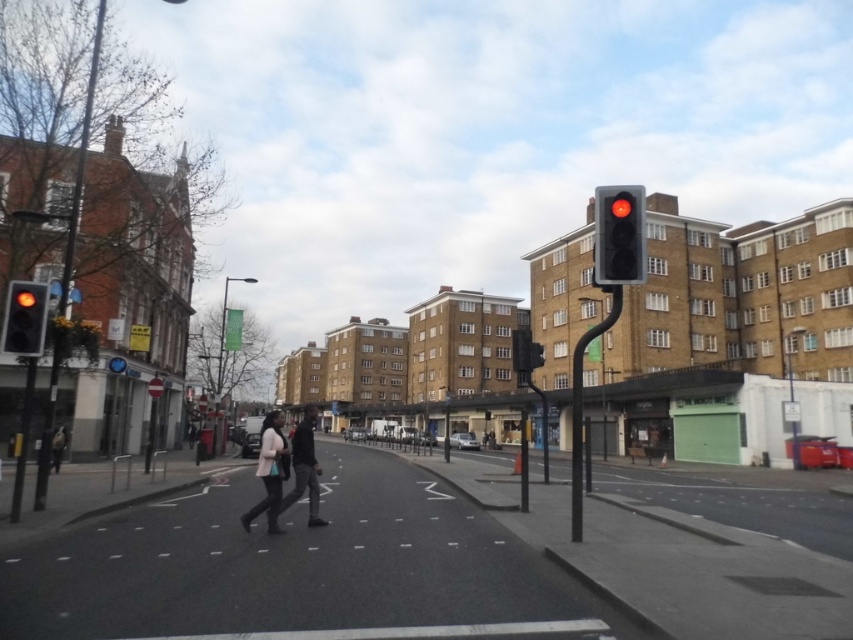
Does dark gray fabric jacket at center have a larger size compared to dark blue jacket at lower left?

Yes.

Is dark gray fabric jacket at center taller than dark blue jacket at lower left?

Yes, dark gray fabric jacket at center is taller than dark blue jacket at lower left.

Is point (299, 474) more distant than point (54, 442)?

No, (299, 474) is in front of (54, 442).

Image resolution: width=853 pixels, height=640 pixels. Find the location of `dark gray fabric jacket at center`. dark gray fabric jacket at center is located at coordinates (305, 467).

Can you confirm if red glass traffic light at upper right is positioned to the left of dark blue jacket at lower left?

In fact, red glass traffic light at upper right is to the right of dark blue jacket at lower left.

Who is more forward, (631, 193) or (67, 436)?

Point (631, 193) is more forward.

I want to click on red glass traffic light at upper right, so click(619, 234).

Which is above, matte black jacket at center or dark gray fabric jacket at center?

matte black jacket at center

Is point (274, 472) positioned after point (300, 435)?

No, it is not.

Locate an element on the screen. matte black jacket at center is located at coordinates (270, 472).

The image size is (853, 640). Identify the location of matte black jacket at center. (270, 472).